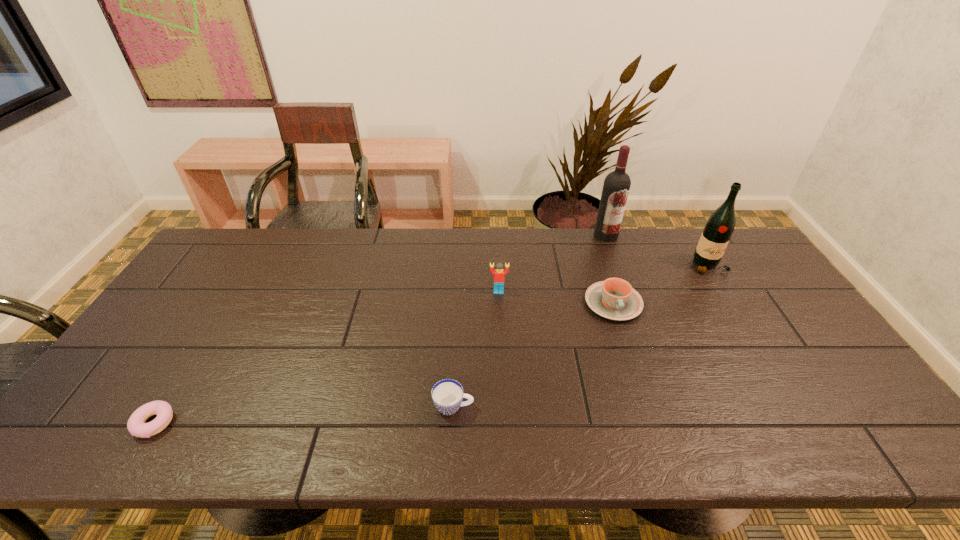
Find the location of `vacant position in the image that satisfies the following two spatial constraints: 1. on the handle side of the chinaware; 2. on the side of the second object from left to right with the handle`. vacant position in the image that satisfies the following two spatial constraints: 1. on the handle side of the chinaware; 2. on the side of the second object from left to right with the handle is located at coordinates (647, 407).

I want to click on vacant space that satisfies the following two spatial constraints: 1. on the surface of the second farthest object; 2. on the side of the cup with the handle, so pos(795,407).